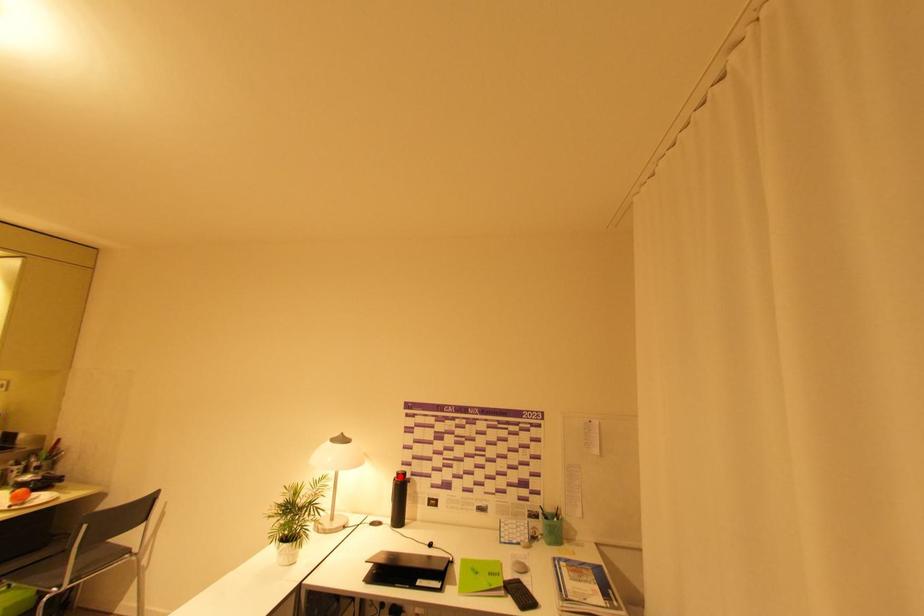
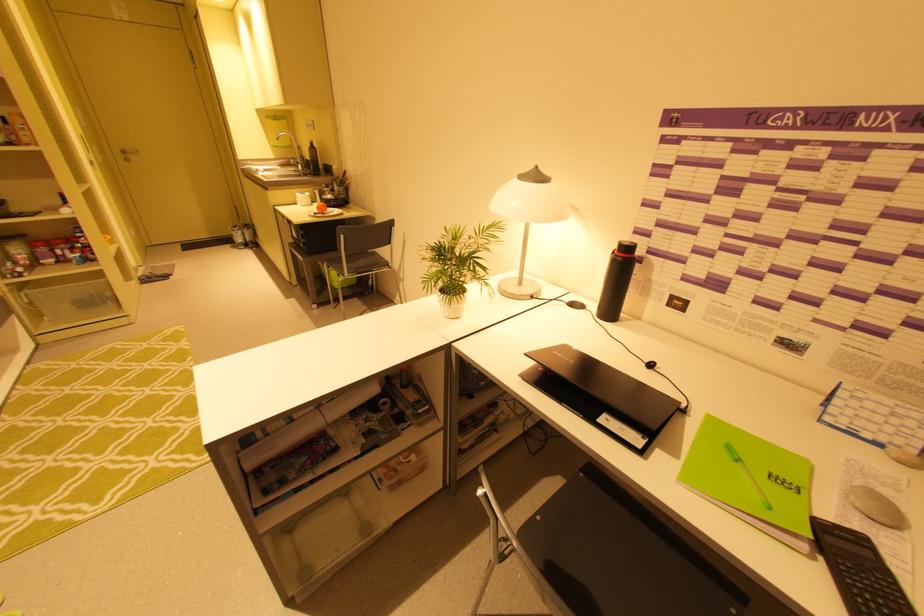
Question: A red point is marked in image1. In image2, is the corresponding 3D point closer to the camera or farther? Reply with the corresponding letter.

Choices:
 (A) The corresponding 3D point is closer.
 (B) The corresponding 3D point is farther.

Answer: (A)